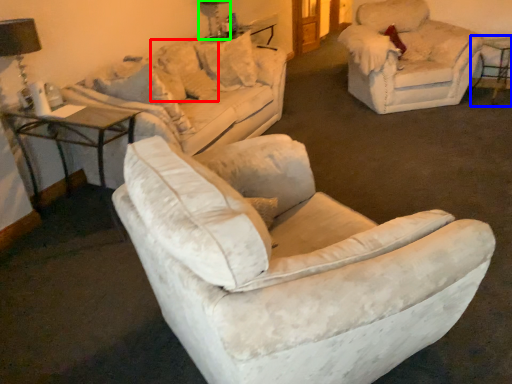
Question: Which object is the farthest from pillow (highlighted by a red box)? Choose among these: bar stool (highlighted by a blue box) or table lamp (highlighted by a green box).

Choices:
 (A) bar stool
 (B) table lamp

Answer: (A)